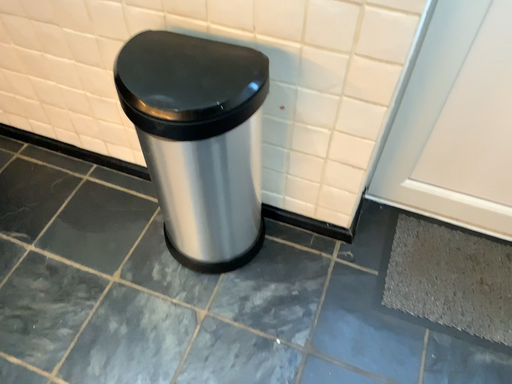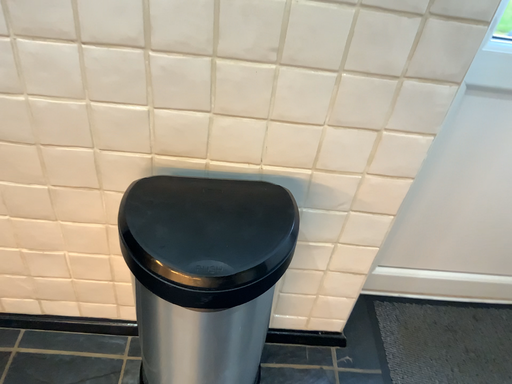
Question: How did the camera likely rotate when shooting the video?

Choices:
 (A) rotated left
 (B) rotated right

Answer: (B)